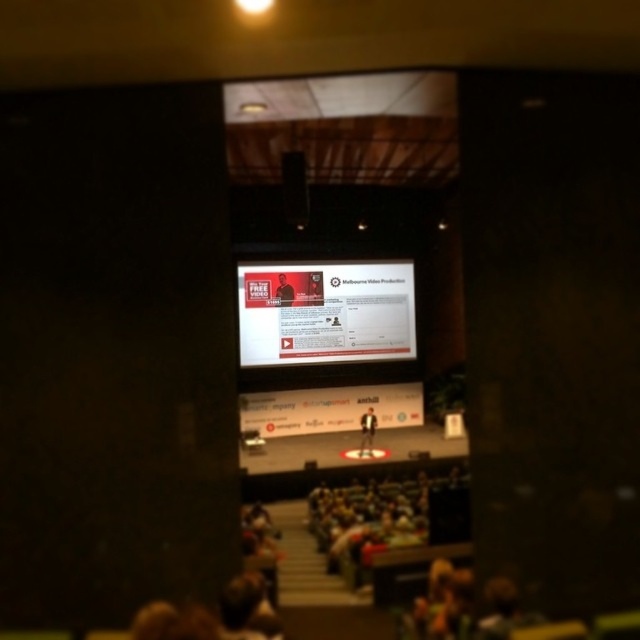
You are an event organizer planning to set up a projector for the next presentation. The projector is placed at the back of the room. Considering the current setup with the matte white screen at center and the matte black speaker at center, which object will the projector beam hit first?

The projector beam will hit the matte white screen at center first because it is larger in size compared to the matte black speaker at center, making it the primary target in the center of the stage.

Based on the scene description, where is the matte black speaker at center located in the image?

The matte black speaker at center is located at point coordinates of (x=294, y=188).

You are sitting in the audience and want to know which of the two points, point (269, 268) or point (368, 449), is closer to you. Can you determine this based on the image?

Point (269, 268) is closer to you than point (368, 449) because it is further to the viewer.